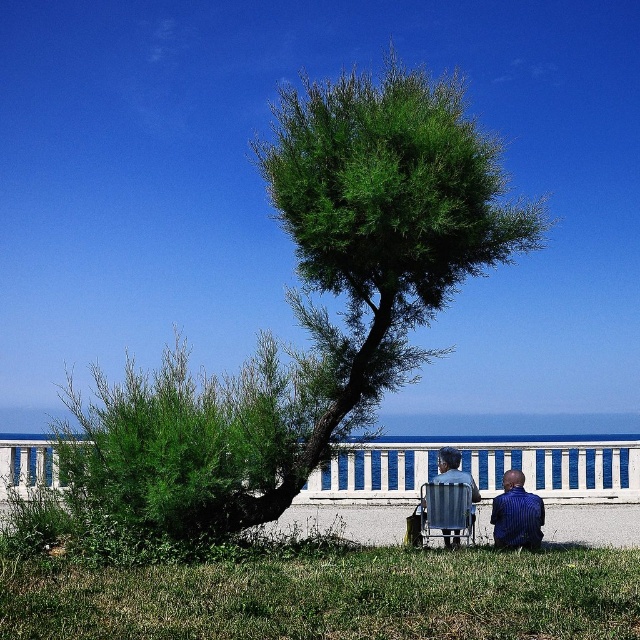
Question: Among these objects, which one is farthest from the camera?

Choices:
 (A) blue striped shirt at lower right
 (B) metallic silver beach chair at lower center

Answer: (B)

Question: Does green leafy tree at center have a smaller size compared to metallic silver beach chair at lower center?

Choices:
 (A) no
 (B) yes

Answer: (B)

Question: Can you confirm if green leafy tree at center is positioned to the left of metallic silver beach chair at lower center?

Choices:
 (A) yes
 (B) no

Answer: (A)

Question: Is green leafy tree at center wider than blue striped shirt at lower right?

Choices:
 (A) yes
 (B) no

Answer: (B)

Question: Which of the following is the closest to the observer?

Choices:
 (A) (422, 534)
 (B) (520, 490)

Answer: (A)

Question: Which object appears farthest from the camera in this image?

Choices:
 (A) metallic silver beach chair at lower center
 (B) blue striped shirt at lower right

Answer: (A)